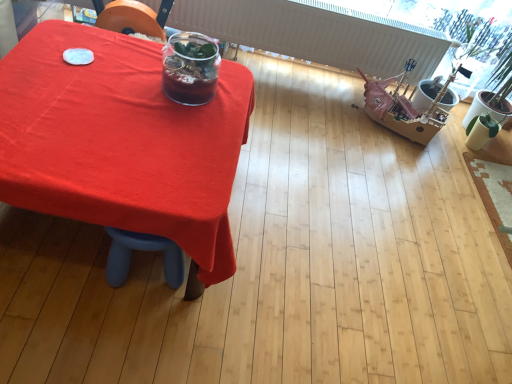
This screenshot has width=512, height=384. Identify the location of free space above matte red tablecloth at center (from a real-world perspective). (112, 114).